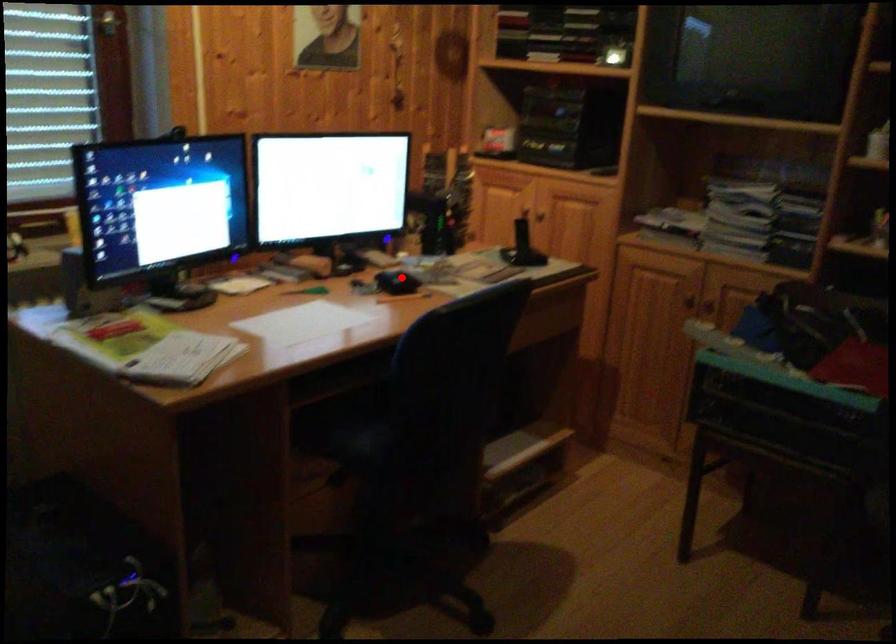
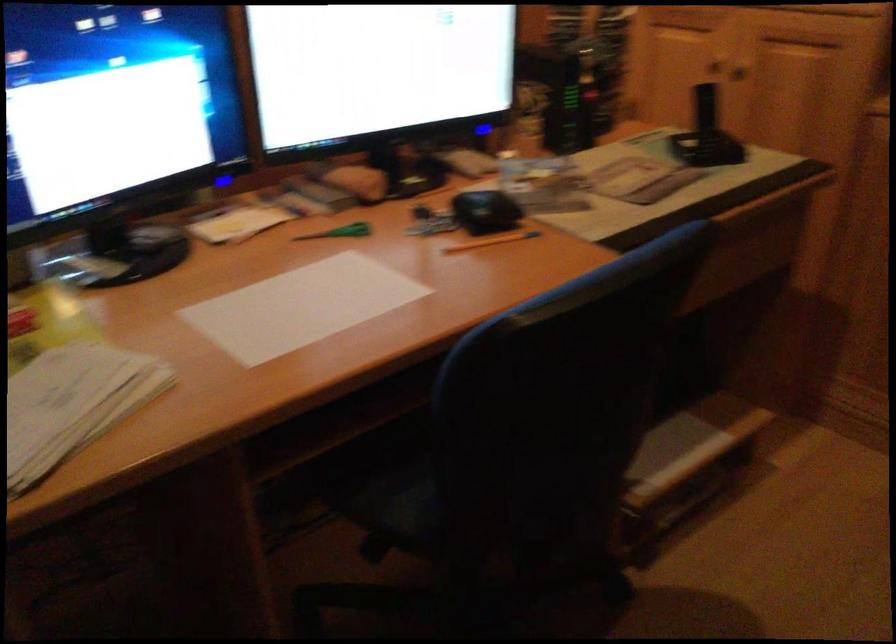
Question: I am providing you with two images of the same scene from different viewpoints. In image1, a red point is highlighted. Considering the same 3D point in image2, which of the following is correct?

Choices:
 (A) It is closer
 (B) It is farther

Answer: (A)